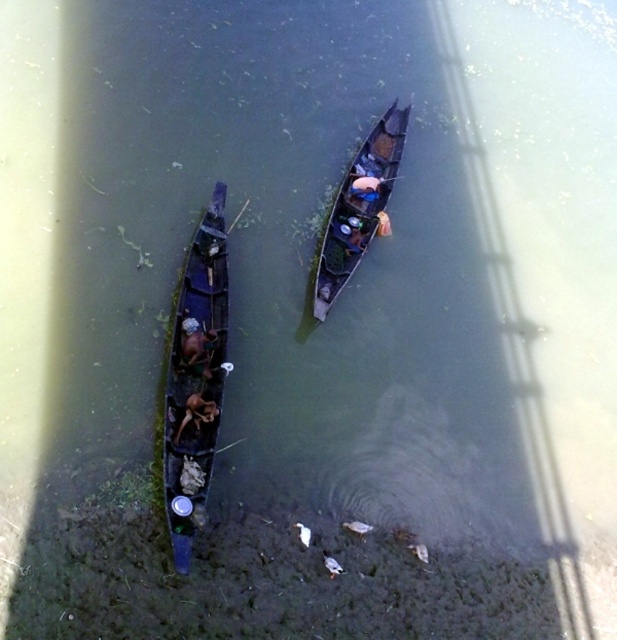
This screenshot has height=640, width=617. Describe the element at coordinates (196, 380) in the screenshot. I see `dark wood canoe at left` at that location.

Between dark wood canoe at left and dark wood boat at center, which one is positioned higher?

dark wood boat at center is above.

Is point (220, 365) closer to viewer compared to point (373, 230)?

Yes, it is in front of point (373, 230).

The height and width of the screenshot is (640, 617). In order to click on dark wood canoe at left in this screenshot , I will do `click(196, 380)`.

Which is below, dark wood boat at center or dark brown wooden boat at center?

dark brown wooden boat at center is below.

Is point (400, 141) behind point (188, 321)?

That is True.

Is point (371, 134) in front of point (184, 358)?

No, (371, 134) is behind (184, 358).

Where is `dark wood boat at center`? The image size is (617, 640). dark wood boat at center is located at coordinates (358, 208).

Is dark wood canoe at left to the left of dark brown wooden boat at center from the viewer's perspective?

In fact, dark wood canoe at left is to the right of dark brown wooden boat at center.

Can you confirm if dark wood canoe at left is smaller than dark brown wooden boat at center?

Actually, dark wood canoe at left might be larger than dark brown wooden boat at center.

Is point (181, 540) farther from camera compared to point (197, 365)?

No, (181, 540) is closer to viewer.

This screenshot has width=617, height=640. Identify the location of dark wood canoe at left. (196, 380).